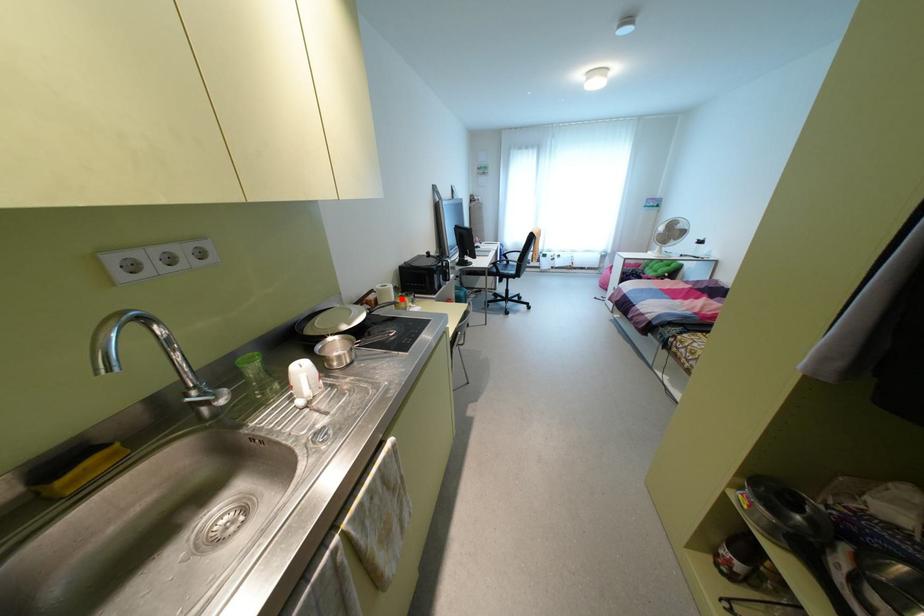
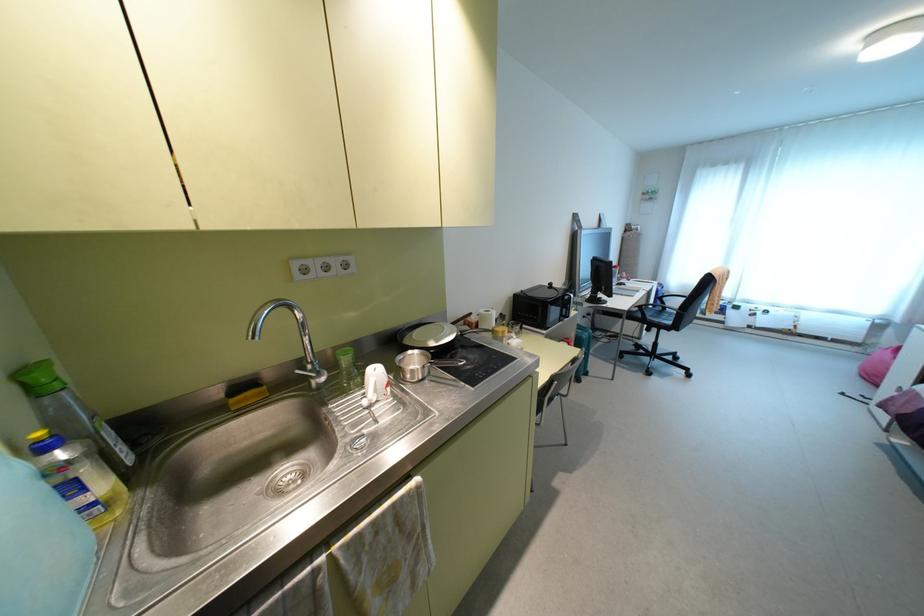
In the second image, find the point that corresponds to the highlighted location in the first image.

(500, 328)